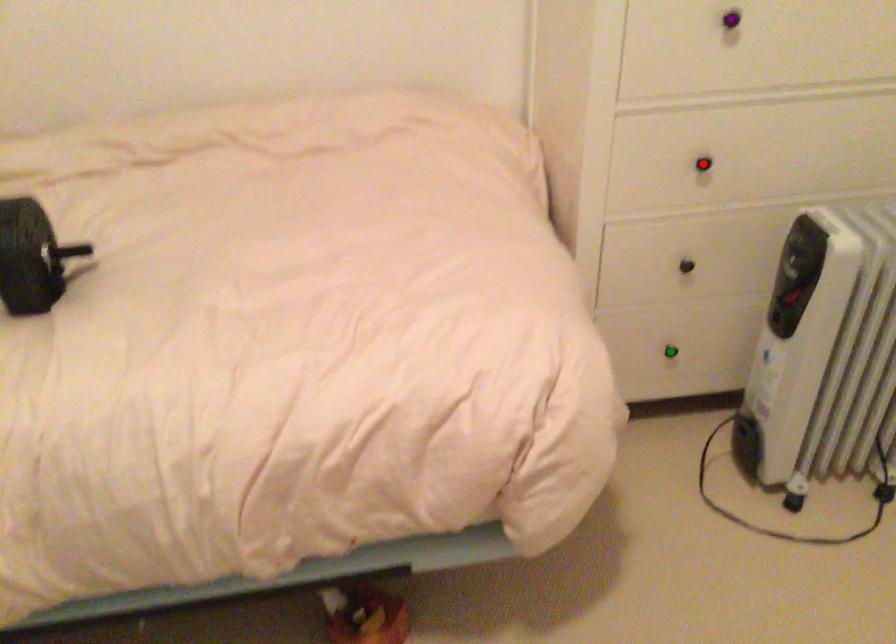
Order these from nearest to farthest:
green point, purple point, red point

1. purple point
2. red point
3. green point